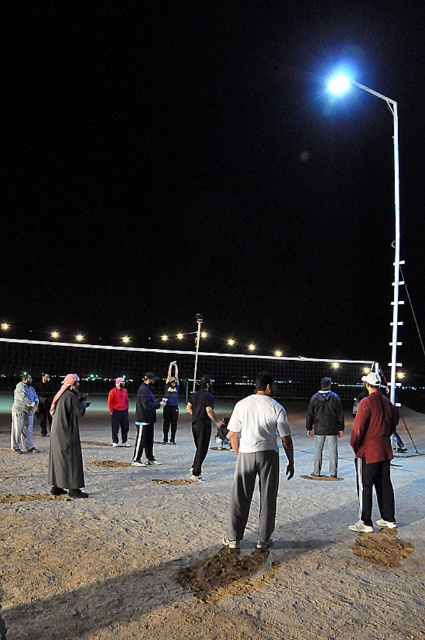
You are a photographer standing at the edge of the volleyball court. You want to take a photo that includes both the white mesh net at center and the white matte shirt at center. Which object should you focus on first to ensure both are in the frame?

The white mesh net at center is below the white matte shirt at center, so you should focus on the white matte shirt at center first to ensure both are in the frame.

You are a photographer setting up a camera on the volleyball court. You want to capture both the brown sand at center and the white mesh net at center in your shot. Which object will appear narrower in the photo?

The brown sand at center will appear narrower in the photo because it has a lesser width compared to the white mesh net at center.